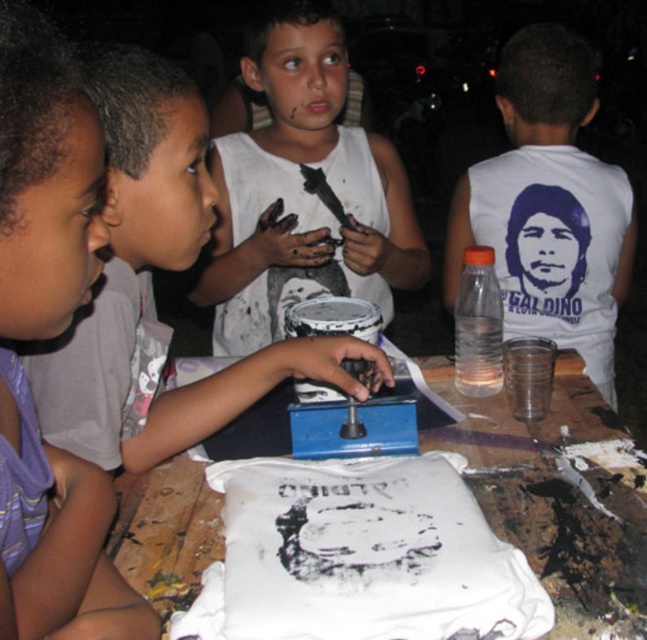
Where is `white matte t-shirt at center`? This screenshot has width=647, height=640. white matte t-shirt at center is located at coordinates (360, 556).

Is the position of white matte t-shirt at center less distant than that of purple fabric shirt at left?

No.

Is point (441, 568) positioned before point (49, 204)?

No, (441, 568) is behind (49, 204).

The image size is (647, 640). In order to click on white matte t-shirt at center in this screenshot , I will do `click(360, 556)`.

Does white matte t-shirt at center have a smaller size compared to white matte shirt at center?

Yes.

Is point (413, 474) closer to viewer compared to point (604, 252)?

Yes, it is in front of point (604, 252).

Is point (267, 624) in front of point (532, 35)?

Yes.

The height and width of the screenshot is (640, 647). I want to click on white matte t-shirt at center, so click(x=360, y=556).

Measure the distance between point (96, 512) and camera.

They are 27.17 inches apart.

Is purple fabric shirt at left to the right of white matte paint can at center from the viewer's perspective?

No, purple fabric shirt at left is not to the right of white matte paint can at center.

I want to click on purple fabric shirt at left, so click(x=45, y=180).